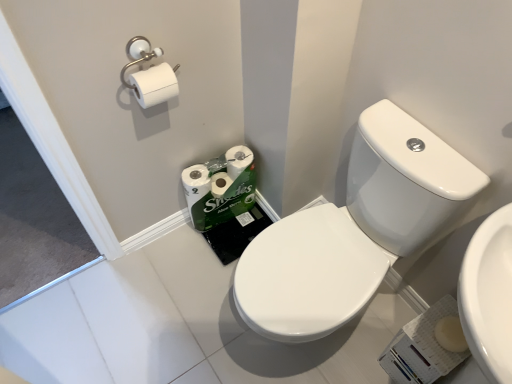
The width and height of the screenshot is (512, 384). Find the location of `vacant space in front of green matte toilet paper at lower center, the second toilet paper in the front-to-back sequence`. vacant space in front of green matte toilet paper at lower center, the second toilet paper in the front-to-back sequence is located at coordinates tap(214, 255).